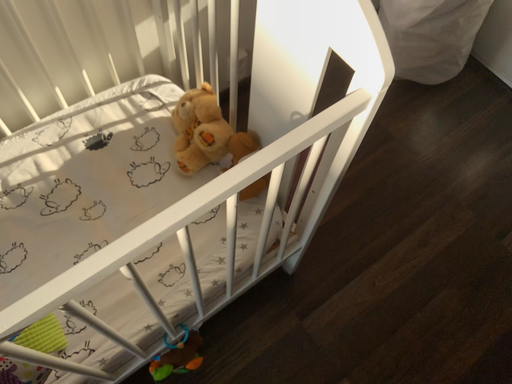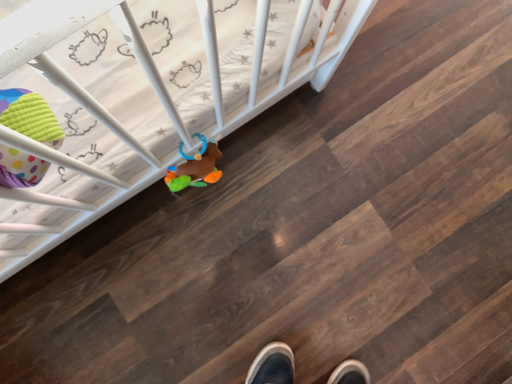
Question: How did the camera likely rotate when shooting the video?

Choices:
 (A) rotated downward
 (B) rotated upward

Answer: (A)